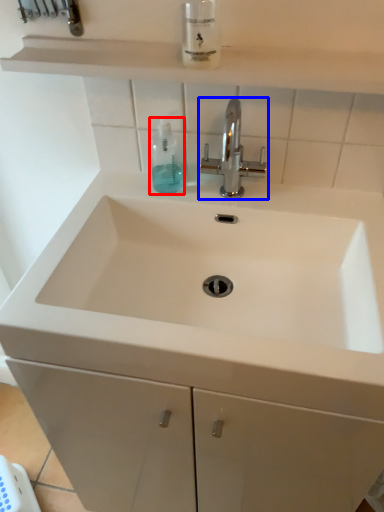
Question: Which of the following is the closest to the observer, mouthwash (highlighted by a red box) or tap (highlighted by a blue box)?

Choices:
 (A) mouthwash
 (B) tap

Answer: (B)